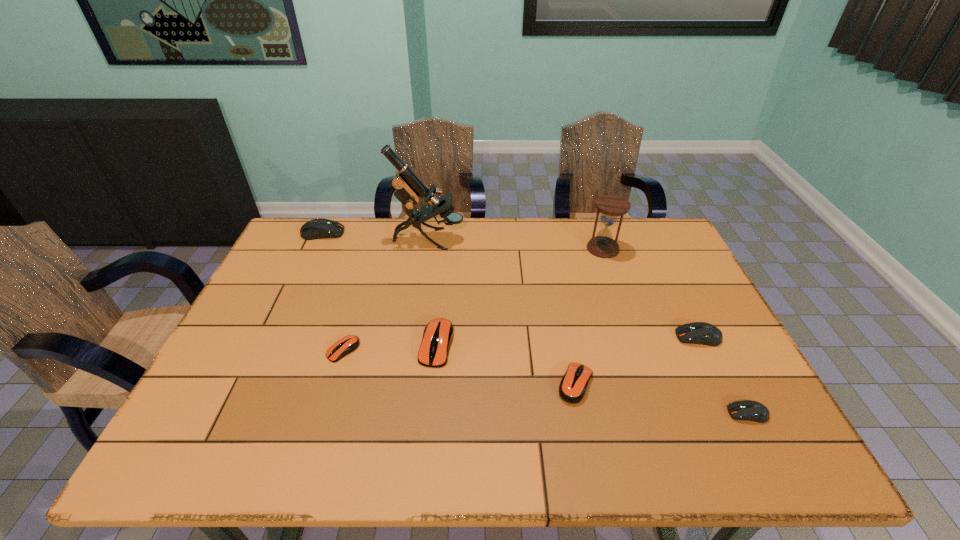
In the image, there is a desktop. At what (x,y) coordinates should I click in order to perform the action: click on vacant space at the far edge. Please return your answer as a coordinate pair (x, y). Looking at the image, I should click on (437, 222).

Identify the location of vacant region at the near edge of the desktop. (642, 458).

In the image, there is a desktop. Where is `vacant space at the left edge`? The width and height of the screenshot is (960, 540). vacant space at the left edge is located at coordinates [x=280, y=350].

This screenshot has width=960, height=540. Find the location of `free space at the right edge of the desktop`. free space at the right edge of the desktop is located at coordinates pos(692,284).

Find the location of a particular element. vacant region at the far left corner of the desktop is located at coordinates (298, 232).

In the image, there is a desktop. Where is `vacant space at the far right corner`? The width and height of the screenshot is (960, 540). vacant space at the far right corner is located at coordinates (636, 241).

Find the location of a particular element. This screenshot has width=960, height=540. vacant space that is in between the tallest object and the sixth object from left to right is located at coordinates (516, 244).

Where is `free spot between the leftmost dark computer equipment and the second object from left to right`? The width and height of the screenshot is (960, 540). free spot between the leftmost dark computer equipment and the second object from left to right is located at coordinates (333, 292).

Locate an element on the screen. This screenshot has height=540, width=960. free space that is in between the fourth computer mouse from right to left and the second nearest dark computer equipment is located at coordinates click(567, 341).

Locate an element on the screen. This screenshot has width=960, height=540. unoccupied position between the hourglass and the rightmost orange computer mouse is located at coordinates (589, 316).